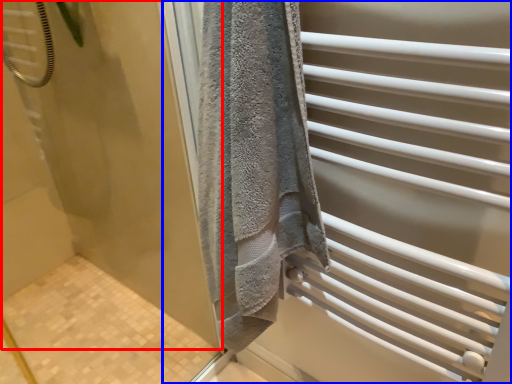
Question: Which object is further to the camera taking this photo, screen door (highlighted by a red box) or screen door (highlighted by a blue box)?

Choices:
 (A) screen door
 (B) screen door

Answer: (B)